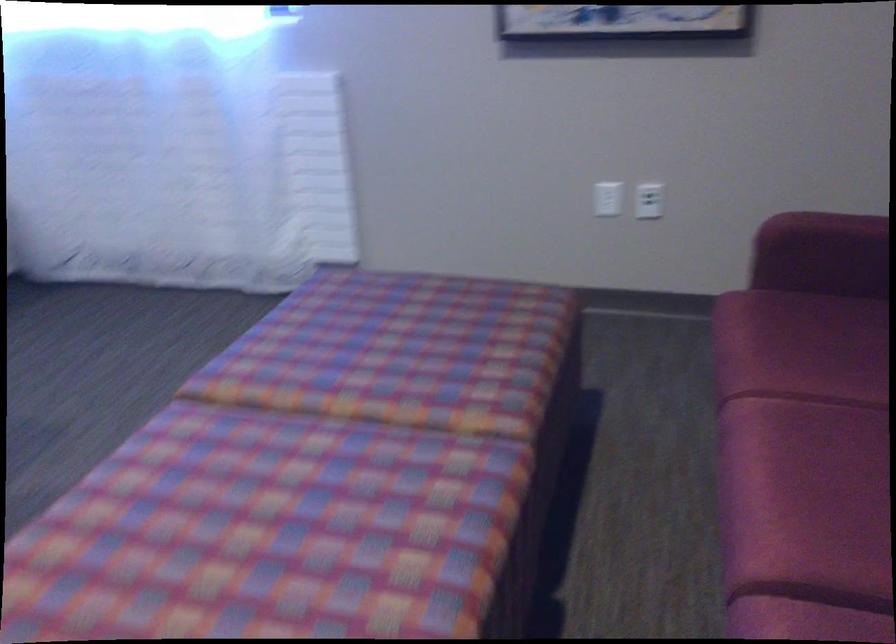
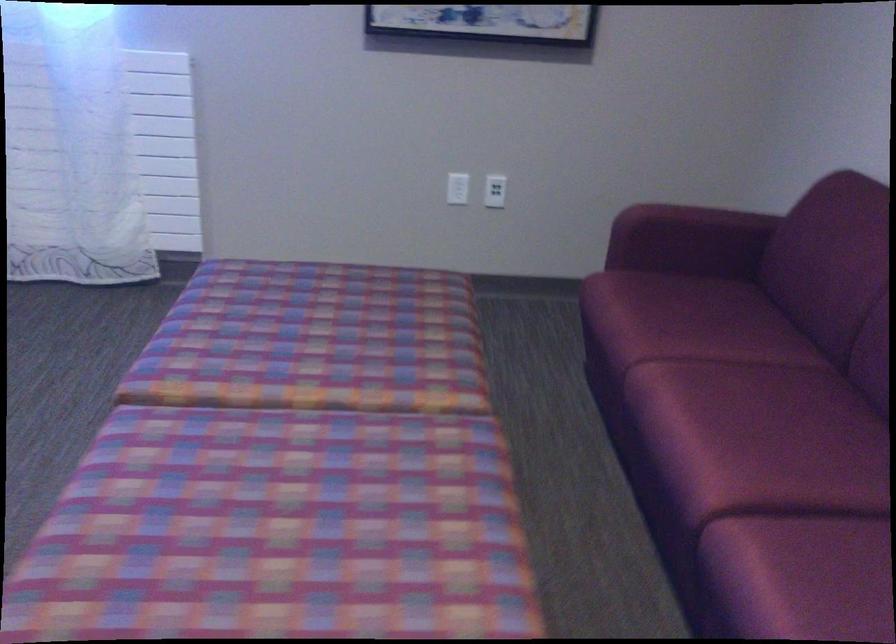
Question: Which direction would the cameraman need to move to produce the second image? Reply with the corresponding letter.

Choices:
 (A) Left
 (B) Right
 (C) Forward
 (D) Backward

Answer: (A)